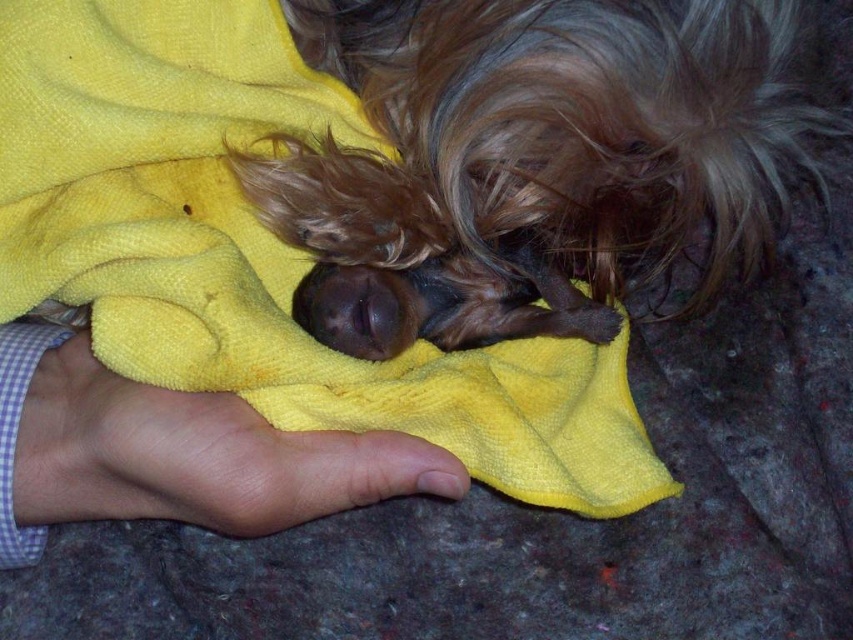
Which is below, shaggy brown fur at center or smooth skin hand at lower left?

smooth skin hand at lower left is below.

Measure the distance between shaggy brown fur at center and camera.

shaggy brown fur at center is 72.23 centimeters from camera.

Where is `shaggy brown fur at center`? shaggy brown fur at center is located at coordinates (529, 160).

Is shaggy brown fur at center below yellow towel at center?

Actually, shaggy brown fur at center is above yellow towel at center.

Who is taller, shaggy brown fur at center or yellow towel at center?

With more height is yellow towel at center.

What do you see at coordinates (529, 160) in the screenshot? This screenshot has height=640, width=853. I see `shaggy brown fur at center` at bounding box center [529, 160].

In order to click on shaggy brown fur at center in this screenshot , I will do `click(529, 160)`.

Who is taller, yellow towel at center or smooth skin hand at lower left?

yellow towel at center is taller.

Based on the photo, does yellow towel at center appear on the right side of smooth skin hand at lower left?

Correct, you'll find yellow towel at center to the right of smooth skin hand at lower left.

Who is more distant from viewer, (x=250, y=132) or (x=57, y=513)?

Point (x=250, y=132)

The width and height of the screenshot is (853, 640). What are the coordinates of `yellow towel at center` in the screenshot? It's located at click(256, 250).